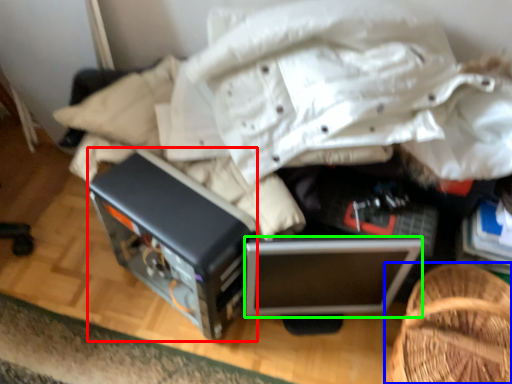
Question: Estimate the real-world distances between objects in this image. Which object is farther from appliance (highlighted by a red box), furniture (highlighted by a blue box) or computer (highlighted by a green box)?

Choices:
 (A) furniture
 (B) computer

Answer: (A)